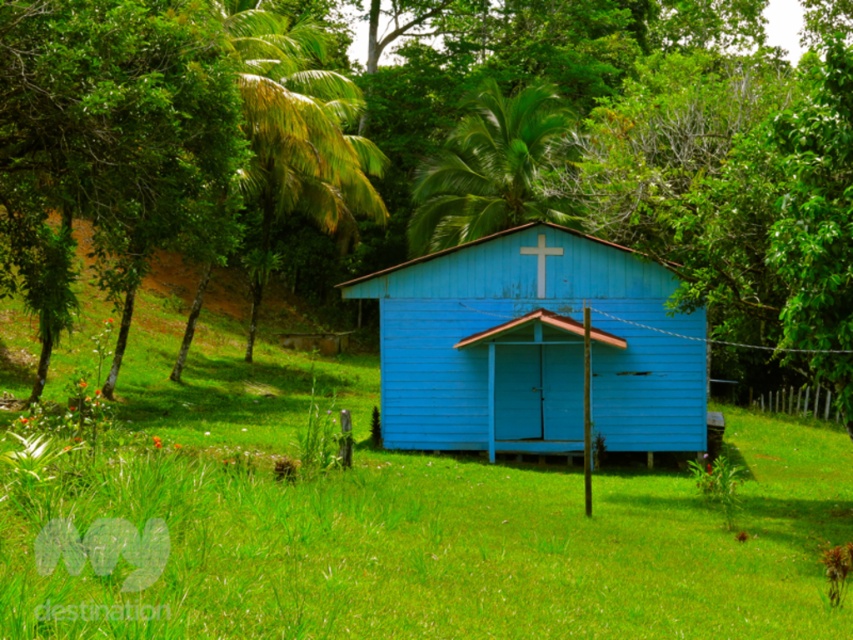
You are standing at the point marked as point (532, 348) in the image. What structure are you currently located on?

You are standing on the blue wooden hut at center.

Consider the image. You are standing at the origin point in the image. Which direction should you move to reach the blue wooden hut at center?

The blue wooden hut at center is located at point 0.544 on the x and 0.626 on the y axis. Since you are at the origin, you should move towards the right and upwards to reach it.